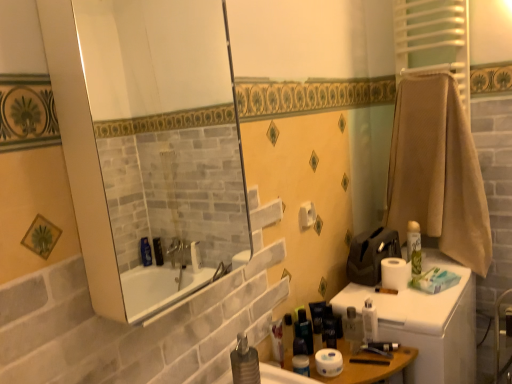
Question: Is white matte toilet paper at lower center, which ranks as the 3th toilet paper in back-to-front order, inside the boundaries of beige textured towel at right, or outside?

Choices:
 (A) inside
 (B) outside

Answer: (B)

Question: From the image's perspective, relative to beige textured towel at right, is white matte toilet paper at lower center, which is the 3th toilet paper from top to bottom, above or below?

Choices:
 (A) above
 (B) below

Answer: (B)

Question: Which is nearer to the translucent plastic bottle at center, the 6th toiletry when ordered from right to left?

Choices:
 (A) matte black soap dispenser at lower right, the 5th toiletry from the left
 (B) metallic silver soap dispenser at lower center
 (C) green matte spray can at right, the 7th toiletry viewed from the left
 (D) translucent plastic bottle at lower center, placed as the seventh toiletry when sorted from right to left
 (E) beige textured towel at right

Answer: (D)

Question: Which is nearer to the matte black soap dispenser at lower right, the 5th toiletry from the left?

Choices:
 (A) white matte toilet paper at upper center, placed as the 3th toilet paper when sorted from bottom to top
 (B) beige textured towel at right
 (C) white matte toilet paper at lower center, which ranks as the 3th toilet paper in back-to-front order
 (D) white matte toilet paper at right, which is the third toilet paper from left to right
 (E) translucent plastic bottle at center, the 6th toiletry when ordered from right to left

Answer: (C)